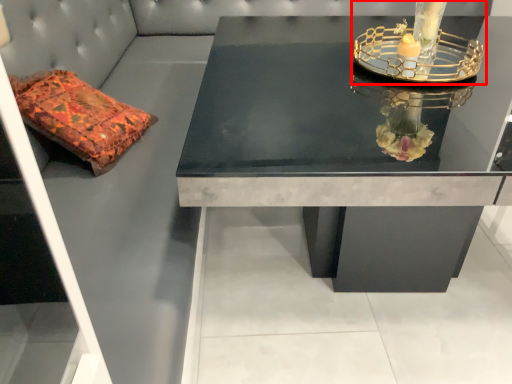
Question: Considering the relative positions of candle holder (annotated by the red box) and table in the image provided, where is candle holder (annotated by the red box) located with respect to the staircase?

Choices:
 (A) right
 (B) left

Answer: (A)